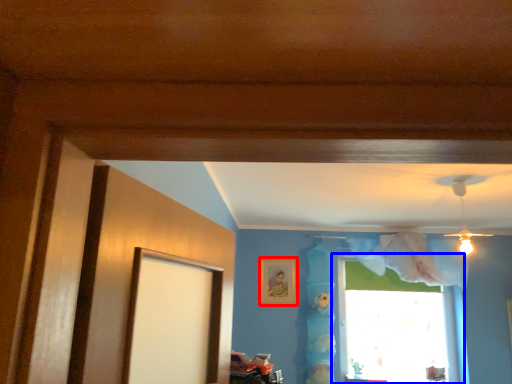
Question: Which point is further to the camera, picture frame (highlighted by a red box) or window (highlighted by a blue box)?

Choices:
 (A) picture frame
 (B) window

Answer: (A)